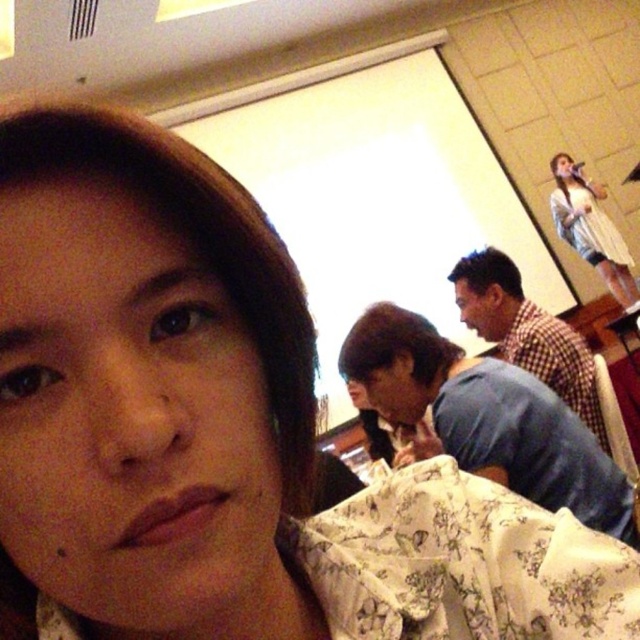
Question: Is floral fabric at center positioned in front of white sheer dress at upper right?

Choices:
 (A) yes
 (B) no

Answer: (A)

Question: Which of the following is the farthest from the observer?

Choices:
 (A) (589, 481)
 (B) (554, 166)

Answer: (B)

Question: Among these points, which one is farthest from the camera?

Choices:
 (A) (500, 483)
 (B) (481, 307)
 (C) (627, 308)

Answer: (C)

Question: Does blue plaid shirt at center appear over white sheer dress at upper right?

Choices:
 (A) yes
 (B) no

Answer: (B)

Question: Considering the real-world distances, which object is closest to the white sheer dress at upper right?

Choices:
 (A) blue plaid shirt at center
 (B) floral fabric at center

Answer: (A)

Question: Can you confirm if floral fabric at center is positioned above white sheer dress at upper right?

Choices:
 (A) yes
 (B) no

Answer: (B)